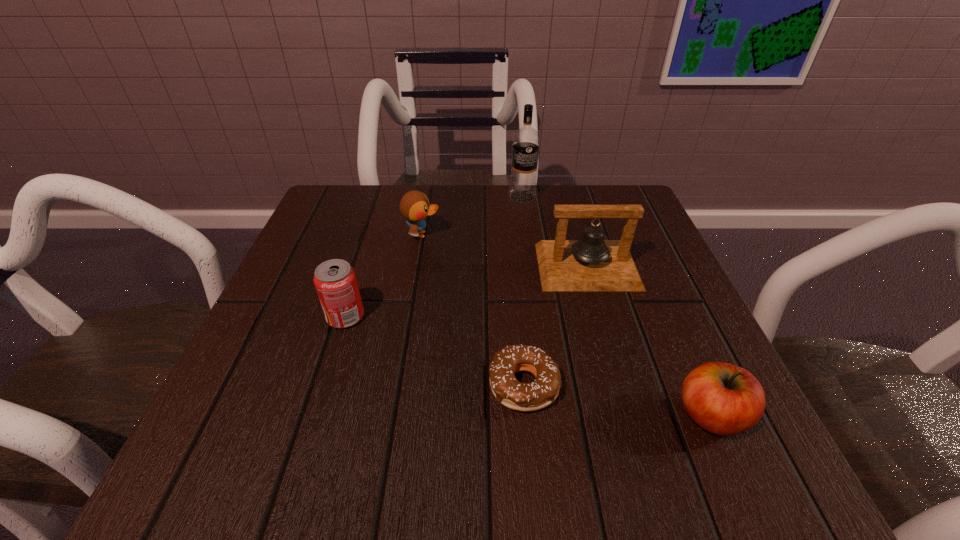
Identify the location of blank space located 0.120m on the label of the tallest object. (528, 234).

You are a GUI agent. You are given a task and a screenshot of the screen. Output one action in this format:
    pyautogui.click(x=<x>, y=<y>)
    Task: Click on the free region located on the left of the bell
    The image size is (960, 540).
    Given the screenshot: What is the action you would take?
    pyautogui.click(x=441, y=267)

The width and height of the screenshot is (960, 540). Find the location of `vacant space located on the right of the fourth farthest object`. vacant space located on the right of the fourth farthest object is located at coordinates (435, 316).

Identify the location of free space located on the front-facing side of the duck. The width and height of the screenshot is (960, 540). (521, 234).

At what (x,y) coordinates should I click in order to perform the action: click on vacant space located 0.220m on the left of the apple. Please return your answer as a coordinate pair (x, y). The height and width of the screenshot is (540, 960). Looking at the image, I should click on (517, 416).

The image size is (960, 540). I want to click on vacant space positioned on the back of the doughnut, so click(516, 296).

Where is `vodka that is at the far edge`? The image size is (960, 540). vodka that is at the far edge is located at coordinates (526, 140).

Where is `bell present at the far edge`? bell present at the far edge is located at coordinates (591, 263).

The image size is (960, 540). Identify the location of duck present at the far edge. (414, 206).

This screenshot has width=960, height=540. I want to click on object at the near edge, so click(x=724, y=399).